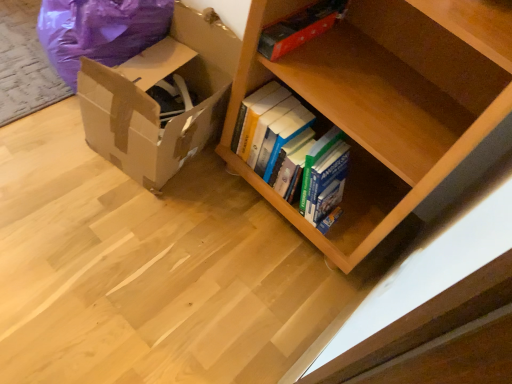
Question: Considering the positions of purple plastic bean bag chair at left and red matte book at upper center in the image, is purple plastic bean bag chair at left taller or shorter than red matte book at upper center?

Choices:
 (A) short
 (B) tall

Answer: (B)

Question: In terms of size, does purple plastic bean bag chair at left appear bigger or smaller than red matte book at upper center?

Choices:
 (A) big
 (B) small

Answer: (A)

Question: Based on their relative distances, which object is farther from the brown cardboard box at lower left?

Choices:
 (A) red matte book at upper center
 (B) hardcover books at center
 (C) purple plastic bean bag chair at left

Answer: (A)

Question: Considering the real-world distances, which object is closest to the brown cardboard box at lower left?

Choices:
 (A) red matte book at upper center
 (B) purple plastic bean bag chair at left
 (C) hardcover books at center

Answer: (B)